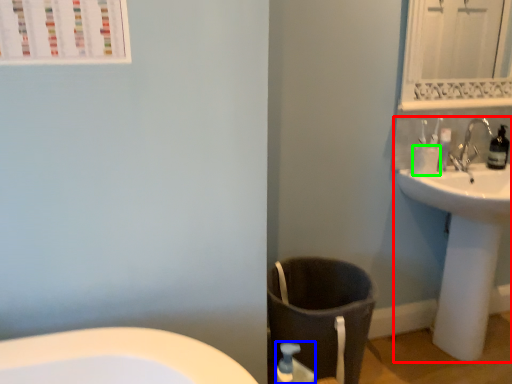
Question: Estimate the real-world distances between objects in this image. Which object is closer to sink (highlighted by a red box), soap dispenser (highlighted by a blue box) or toilet paper (highlighted by a green box)?

Choices:
 (A) soap dispenser
 (B) toilet paper

Answer: (B)